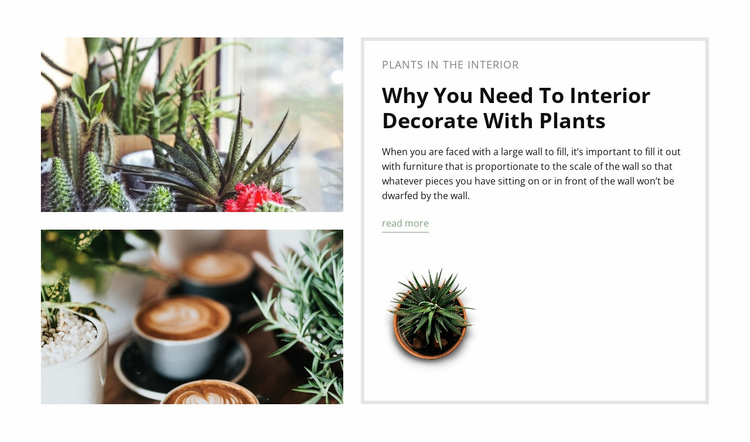
Image resolution: width=750 pixels, height=442 pixels. I want to click on plant, so click(417, 310), click(310, 304), click(68, 261), click(84, 160), click(212, 155), click(115, 85).